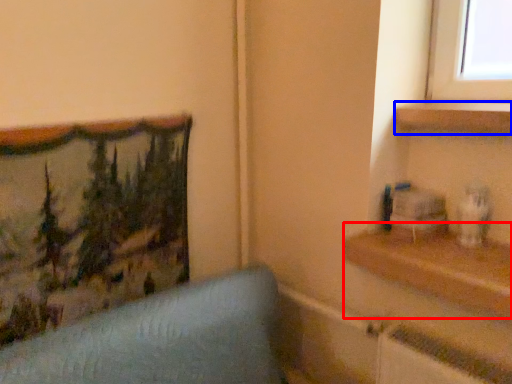
Question: Which of the following is the closest to the observer, shelf (highlighted by a red box) or shelf (highlighted by a blue box)?

Choices:
 (A) shelf
 (B) shelf

Answer: (A)